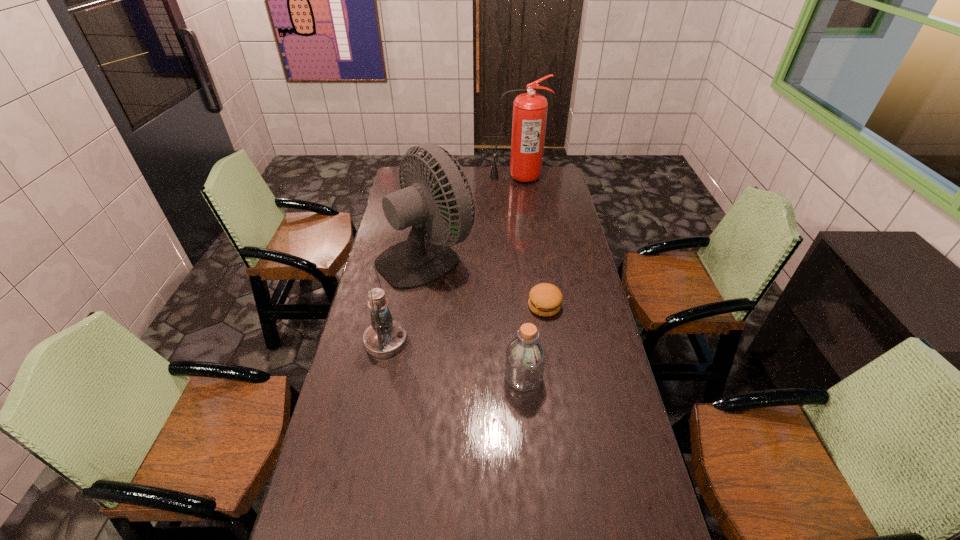
Where is `vacant area at the left edge of the desktop`? Image resolution: width=960 pixels, height=540 pixels. vacant area at the left edge of the desktop is located at coordinates (377, 445).

Identify the location of vacant space at the right edge of the desktop. (570, 319).

I want to click on vacant space at the far right corner of the desktop, so click(553, 168).

Locate an element on the screen. The width and height of the screenshot is (960, 540). free space that is in between the fourth nearest object and the third shortest object is located at coordinates (406, 298).

The image size is (960, 540). Identify the location of vacant space in between the second farthest object and the second shortest object. (475, 316).

In order to click on vacant point located between the second farthest object and the third farthest object in this screenshot , I will do `click(486, 281)`.

Find the location of a particular element. Image resolution: width=960 pixels, height=540 pixels. free spot between the fire extinguisher and the hamburger is located at coordinates (531, 241).

This screenshot has height=540, width=960. I want to click on free space between the fan and the third nearest object, so click(x=486, y=281).

Image resolution: width=960 pixels, height=540 pixels. Find the location of `object that stands as the second closest to the third nearest object`. object that stands as the second closest to the third nearest object is located at coordinates (419, 260).

I want to click on object that is the fourth closest one to the farthest object, so click(525, 359).